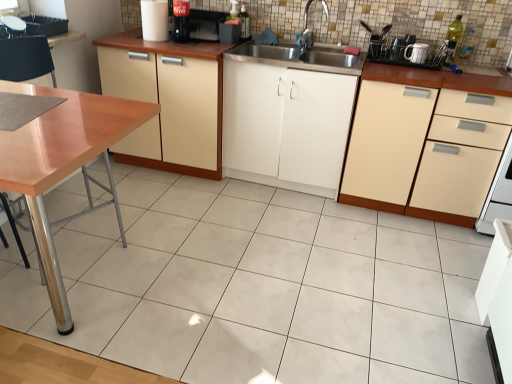
Identify the location of vacant area that is situated to the right of wooden table at left. (238, 295).